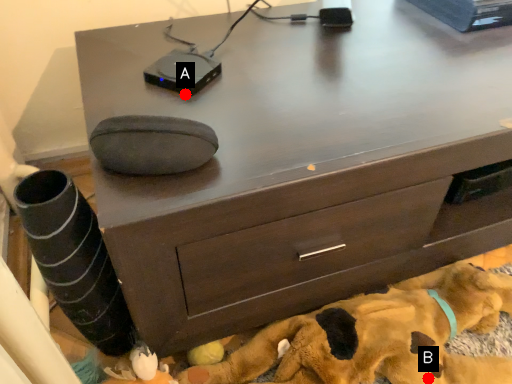
Question: Two points are circled on the image, labeled by A and B beside each circle. Which point appears farthest from the camera in this image?

Choices:
 (A) A is further
 (B) B is further

Answer: (B)